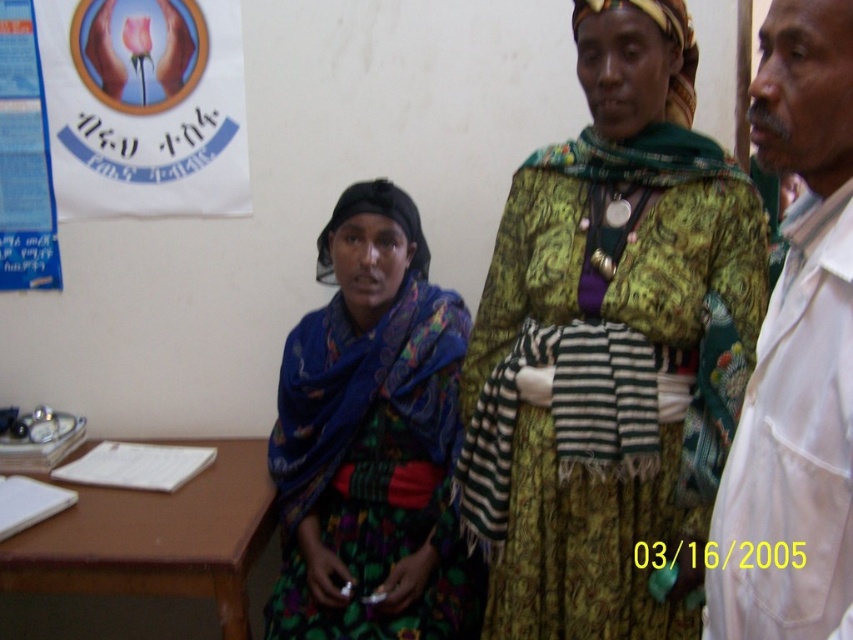
Measure the distance from brown wooden table at lower left to blue paper at left.

The distance of brown wooden table at lower left from blue paper at left is 30.69 inches.

Can you confirm if brown wooden table at lower left is smaller than blue paper at left?

No, brown wooden table at lower left is not smaller than blue paper at left.

Which is in front, point (215, 547) or point (1, 45)?

Point (215, 547)

The image size is (853, 640). I want to click on brown wooden table at lower left, so click(x=155, y=538).

Who is more distant from viewer, [53,65] or [3,70]?

The point [3,70] is more distant.

Is point (146, 148) farther from viewer compared to point (26, 144)?

No.

Identify the location of white paper poster at upper left. The image size is (853, 640). (144, 106).

Does green textured dress at center have a greater width compared to blue paper at left?

Yes.

Which is behind, point (630, 45) or point (10, 250)?

Point (10, 250)

Between point (677, 104) and point (22, 26), which one is positioned in front?

Point (677, 104)

The height and width of the screenshot is (640, 853). Identify the location of green textured dress at center. (614, 340).